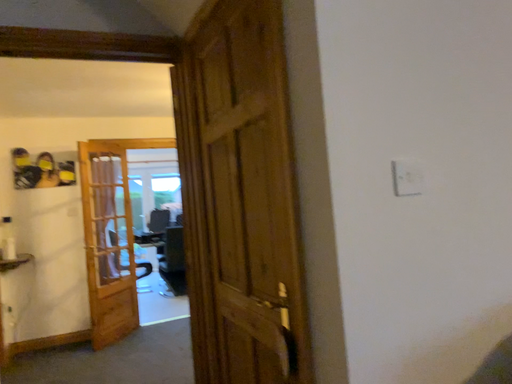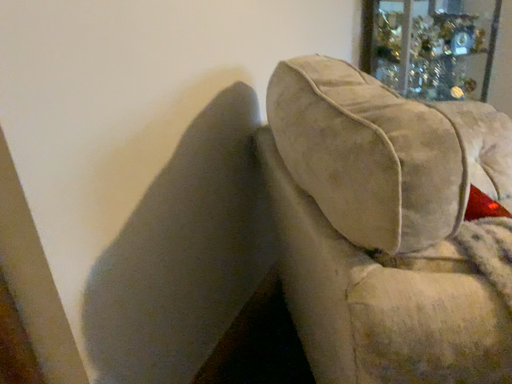
Question: How did the camera likely rotate when shooting the video?

Choices:
 (A) rotated downward
 (B) rotated upward

Answer: (A)